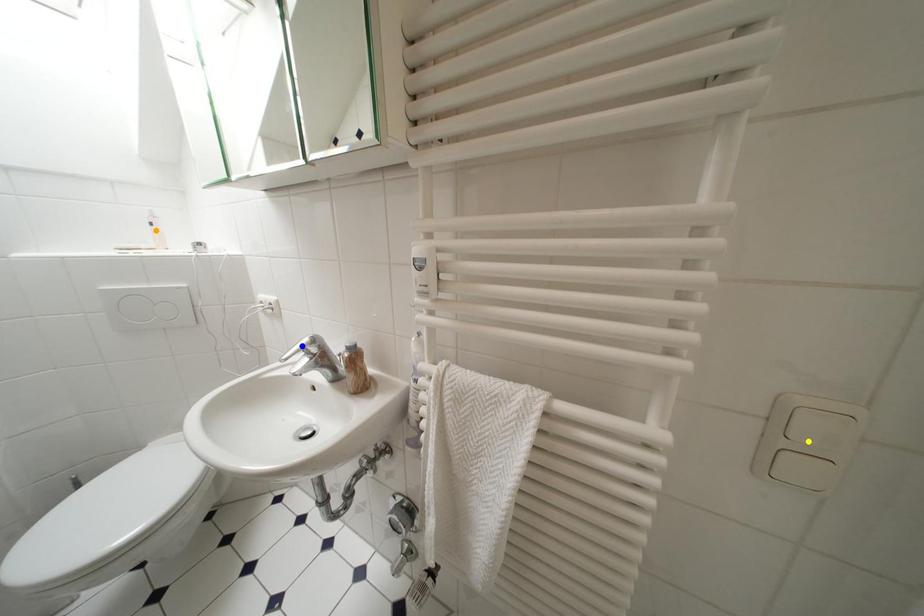
Order these from nearest to farthest:
A) yellow point
B) orange point
C) blue point

orange point < blue point < yellow point